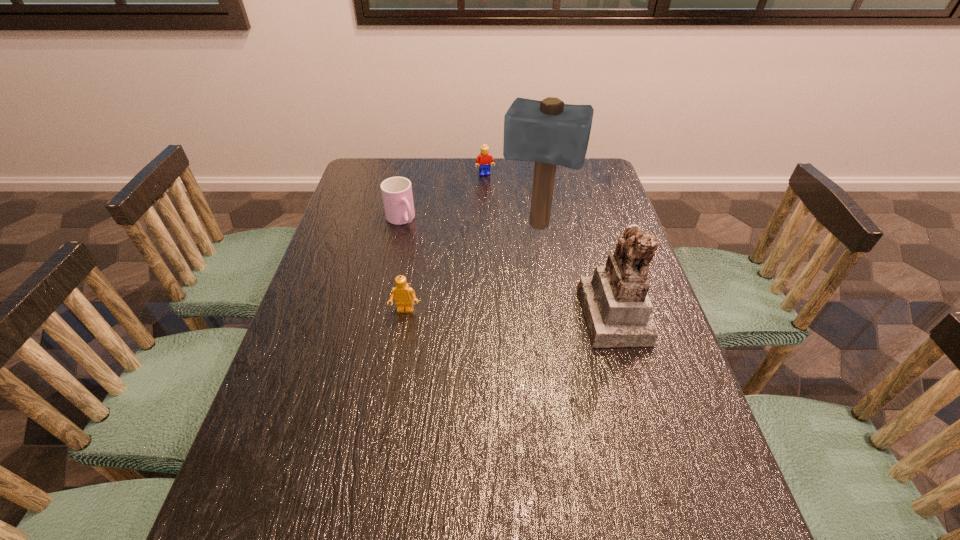
The image size is (960, 540). Find the location of `free spot on the desktop that is between the nearer Lego and the figurine and is positioned on the front-facing side of the farthest object`. free spot on the desktop that is between the nearer Lego and the figurine and is positioned on the front-facing side of the farthest object is located at coordinates (521, 313).

Image resolution: width=960 pixels, height=540 pixels. In order to click on vacant space on the desktop that is between the nearer Lego and the figurine and is positioned on the striking surface of the mallet in this screenshot , I will do `click(511, 313)`.

Where is `vacant space on the desktop that is between the left Lego and the fourth shortest object and is positioned with the handle on the side of the cup`? This screenshot has width=960, height=540. vacant space on the desktop that is between the left Lego and the fourth shortest object and is positioned with the handle on the side of the cup is located at coordinates (477, 312).